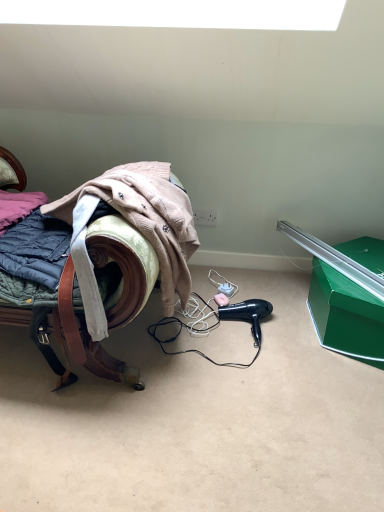
Locate an element on the screen. Image resolution: width=384 pixels, height=512 pixels. free area in between velvet green suitcase at left and black plastic hair dryer at lower center is located at coordinates (206, 342).